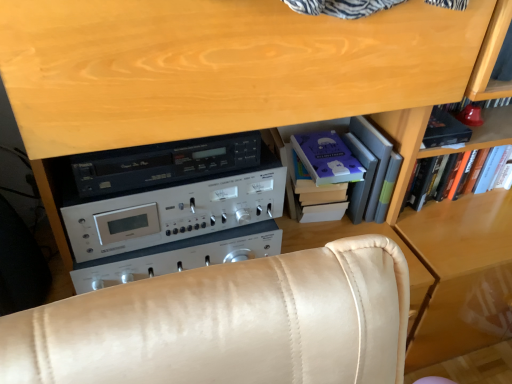
Describe the element at coordinates (351, 161) in the screenshot. The width and height of the screenshot is (512, 384). I see `hardcover books at center, arranged as the 1th shelf when viewed from the left` at that location.

Locate an element on the screen. purple matte paper at center, arranged as the first paperback book when viewed from the left is located at coordinates (327, 157).

Locate an element on the screen. hardcover book at upper right is located at coordinates (472, 171).

At what (x,y) coordinates should I click in order to perform the action: click on matte purple paperback book at upper right, the 1th paperback book in the right-to-left sequence. Please return your answer as a coordinate pair (x, y). This screenshot has height=384, width=512. Looking at the image, I should click on (444, 130).

Image resolution: width=512 pixels, height=384 pixels. What do you see at coordinates (170, 208) in the screenshot?
I see `silver metallic stereo at center` at bounding box center [170, 208].

Measure the distance between point (277, 198) and camera.

37.60 inches.

Where is `wooden bookshelf at right, the 2th shelf positioned from the left`? The width and height of the screenshot is (512, 384). wooden bookshelf at right, the 2th shelf positioned from the left is located at coordinates tap(481, 134).

Is silver metallic stereo at center at the back of hardcover book at upper right?

No, hardcover book at upper right's orientation is not away from silver metallic stereo at center.

Is hardcover book at upper right next to silver metallic stereo at center and touching it?

No, hardcover book at upper right is not making contact with silver metallic stereo at center.

From the image's perspective, is hardcover book at upper right above or below silver metallic stereo at center?

Based on their image positions, hardcover book at upper right is located above silver metallic stereo at center.

Between hardcover book at upper right and silver metallic stereo at center, which one is positioned behind?

Positioned behind is hardcover book at upper right.

Considering the sizes of objects hardcover book at upper right and hardcover books at center, arranged as the 1th shelf when viewed from the left, in the image provided, who is taller, hardcover book at upper right or hardcover books at center, arranged as the 1th shelf when viewed from the left,?

hardcover books at center, arranged as the 1th shelf when viewed from the left.

From the image's perspective, between hardcover book at upper right and hardcover books at center, which is counted as the second shelf, starting from the right, who is located below?

From the image's view, hardcover book at upper right is below.

Based on the photo, between hardcover book at upper right and hardcover books at center, which is counted as the second shelf, starting from the right, which one has larger size?

With larger size is hardcover book at upper right.

Does hardcover book at upper right have a lesser width compared to hardcover books at center, arranged as the 1th shelf when viewed from the left?

Yes, hardcover book at upper right is thinner than hardcover books at center, arranged as the 1th shelf when viewed from the left.

Considering the relative positions of hardcover books at center, arranged as the 1th shelf when viewed from the left, and hardcover book at upper right in the image provided, is hardcover books at center, arranged as the 1th shelf when viewed from the left, to the left or to the right of hardcover book at upper right?

From the image, it's evident that hardcover books at center, arranged as the 1th shelf when viewed from the left, is to the left of hardcover book at upper right.

From the image's perspective, is hardcover books at center, arranged as the 1th shelf when viewed from the left, located above or below hardcover book at upper right?

hardcover books at center, arranged as the 1th shelf when viewed from the left, is situated higher than hardcover book at upper right in the image.

Locate an element on the screen. The height and width of the screenshot is (384, 512). book that is under the hardcover books at center, which is counted as the second shelf, starting from the right (from a real-world perspective) is located at coordinates (x=472, y=171).

From the image's perspective, who appears lower, hardcover books at center, arranged as the 1th shelf when viewed from the left, or silver metallic stereo at center?

silver metallic stereo at center.

From a real-world perspective, is hardcover books at center, which is counted as the second shelf, starting from the right, physically located above or below silver metallic stereo at center?

hardcover books at center, which is counted as the second shelf, starting from the right, is below silver metallic stereo at center.

Based on the photo, are hardcover books at center, which is counted as the second shelf, starting from the right, and silver metallic stereo at center located far from each other?

That's not correct — hardcover books at center, which is counted as the second shelf, starting from the right, is a little close to silver metallic stereo at center.

Which object is positioned more to the left, hardcover books at center, which is counted as the second shelf, starting from the right, or silver metallic stereo at center?

From the viewer's perspective, silver metallic stereo at center appears more on the left side.

Is matte purple paperback book at upper right, arranged as the second paperback book when viewed from the left, not within hardcover book at upper right?

Yes, matte purple paperback book at upper right, arranged as the second paperback book when viewed from the left, is outside of hardcover book at upper right.

Consider the image. Considering the sizes of objects matte purple paperback book at upper right, the 1th paperback book in the right-to-left sequence, and hardcover book at upper right in the image provided, who is smaller, matte purple paperback book at upper right, the 1th paperback book in the right-to-left sequence, or hardcover book at upper right?

Smaller between the two is matte purple paperback book at upper right, the 1th paperback book in the right-to-left sequence.

Which of these two, matte purple paperback book at upper right, arranged as the second paperback book when viewed from the left, or hardcover book at upper right, stands taller?

hardcover book at upper right is taller.

Is point (448, 127) closer or farther from the camera than point (421, 172)?

Point (448, 127).

Which of these two, hardcover book at upper right or matte purple paperback book at upper right, arranged as the second paperback book when viewed from the left, stands taller?

With more height is hardcover book at upper right.

Consider the image. Could you tell me if hardcover book at upper right is facing matte purple paperback book at upper right, arranged as the second paperback book when viewed from the left?

No, hardcover book at upper right is not oriented towards matte purple paperback book at upper right, arranged as the second paperback book when viewed from the left.

In the scene shown: How far apart are hardcover book at upper right and matte purple paperback book at upper right, the 1th paperback book in the right-to-left sequence?

hardcover book at upper right and matte purple paperback book at upper right, the 1th paperback book in the right-to-left sequence, are 16.78 centimeters apart from each other.

Is hardcover book at upper right to the right of matte purple paperback book at upper right, the 1th paperback book in the right-to-left sequence, from the viewer's perspective?

Yes.

From the image's perspective, between wooden bookshelf at right, which is counted as the 1th shelf, starting from the right, and silver metallic stereo at center, who is located below?

silver metallic stereo at center appears lower in the image.

This screenshot has height=384, width=512. Find the location of `the 2nd shelf to the right of the silver metallic stereo at center, counting from the anchor's position`. the 2nd shelf to the right of the silver metallic stereo at center, counting from the anchor's position is located at coordinates (481, 134).

Considering the sizes of objects wooden bookshelf at right, which is counted as the 1th shelf, starting from the right, and silver metallic stereo at center in the image provided, who is taller, wooden bookshelf at right, which is counted as the 1th shelf, starting from the right, or silver metallic stereo at center?

wooden bookshelf at right, which is counted as the 1th shelf, starting from the right.

Relative to silver metallic stereo at center, is wooden bookshelf at right, the 2th shelf positioned from the left, in front or behind?

Visually, wooden bookshelf at right, the 2th shelf positioned from the left, is located behind silver metallic stereo at center.

Where is `book on the right of the silver metallic stereo at center`? book on the right of the silver metallic stereo at center is located at coordinates (472, 171).

Image resolution: width=512 pixels, height=384 pixels. Find the location of `book below the hardcover books at center, arranged as the 1th shelf when viewed from the left (from a real-world perspective)`. book below the hardcover books at center, arranged as the 1th shelf when viewed from the left (from a real-world perspective) is located at coordinates (472, 171).

From the image, which object appears to be farther from matte purple paperback book at upper right, the 1th paperback book in the right-to-left sequence, purple matte paper at center, the second paperback book in the right-to-left sequence, or wooden bookshelf at right, the 2th shelf positioned from the left?

Based on the image, purple matte paper at center, the second paperback book in the right-to-left sequence, appears to be further to matte purple paperback book at upper right, the 1th paperback book in the right-to-left sequence.

Considering their positions, is hardcover book at upper right positioned closer to wooden bookshelf at right, the 2th shelf positioned from the left, than purple matte paper at center, the second paperback book in the right-to-left sequence?

Based on the image, hardcover book at upper right appears to be nearer to wooden bookshelf at right, the 2th shelf positioned from the left.

Based on their spatial positions, is wooden bookshelf at right, which is counted as the 1th shelf, starting from the right, or hardcover books at center, arranged as the 1th shelf when viewed from the left, further from purple matte paper at center, arranged as the first paperback book when viewed from the left?

wooden bookshelf at right, which is counted as the 1th shelf, starting from the right, is positioned further to the anchor purple matte paper at center, arranged as the first paperback book when viewed from the left.

Considering their positions, is purple matte paper at center, the second paperback book in the right-to-left sequence, positioned further to matte purple paperback book at upper right, the 1th paperback book in the right-to-left sequence, than hardcover books at center, which is counted as the second shelf, starting from the right?

Based on the image, purple matte paper at center, the second paperback book in the right-to-left sequence, appears to be further to matte purple paperback book at upper right, the 1th paperback book in the right-to-left sequence.

Which object lies further to the anchor point matte purple paperback book at upper right, the 1th paperback book in the right-to-left sequence, silver metallic stereo at center or wooden bookshelf at right, which is counted as the 1th shelf, starting from the right?

silver metallic stereo at center is further to matte purple paperback book at upper right, the 1th paperback book in the right-to-left sequence.

When comparing their distances from hardcover books at center, which is counted as the second shelf, starting from the right, does matte purple paperback book at upper right, the 1th paperback book in the right-to-left sequence, or wooden bookshelf at right, the 2th shelf positioned from the left, seem further?

The object further to hardcover books at center, which is counted as the second shelf, starting from the right, is matte purple paperback book at upper right, the 1th paperback book in the right-to-left sequence.

When comparing their distances from hardcover books at center, which is counted as the second shelf, starting from the right, does wooden bookshelf at right, the 2th shelf positioned from the left, or hardcover book at upper right seem further?

Based on the image, hardcover book at upper right appears to be further to hardcover books at center, which is counted as the second shelf, starting from the right.

Estimate the real-world distances between objects in this image. Which object is further from purple matte paper at center, arranged as the first paperback book when viewed from the left, hardcover books at center, arranged as the 1th shelf when viewed from the left, or silver metallic stereo at center?

silver metallic stereo at center is further to purple matte paper at center, arranged as the first paperback book when viewed from the left.

You are a GUI agent. You are given a task and a screenshot of the screen. Output one action in this format:
    pyautogui.click(x=<x>, y=<y>)
    Task: Click on the shelf between purple matte paper at center, the second paperback book in the right-to-left sequence, and wooden bookshelf at right, which is counted as the 1th shelf, starting from the right, from left to right
    
    Given the screenshot: What is the action you would take?
    pyautogui.click(x=351, y=161)

At what (x,y) coordinates should I click in order to perform the action: click on paperback book between hardcover books at center, which is counted as the second shelf, starting from the right, and hardcover book at upper right. Please return your answer as a coordinate pair (x, y). The width and height of the screenshot is (512, 384). Looking at the image, I should click on (444, 130).

What are the coordinates of `shelf located between silver metallic stereo at center and hardcover book at upper right in the left-right direction` in the screenshot? It's located at (351, 161).

Locate an element on the screen. The width and height of the screenshot is (512, 384). paperback book between silver metallic stereo at center and matte purple paperback book at upper right, the 1th paperback book in the right-to-left sequence, from left to right is located at coordinates (327, 157).